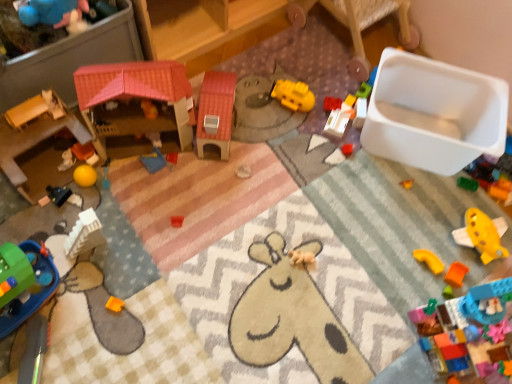
Find the location of a particular element. The height and width of the screenshot is (384, 512). free spot in front of yellow matte plastic arch at lower right, which appears as the twelfth toy when viewed from the left is located at coordinates (412, 305).